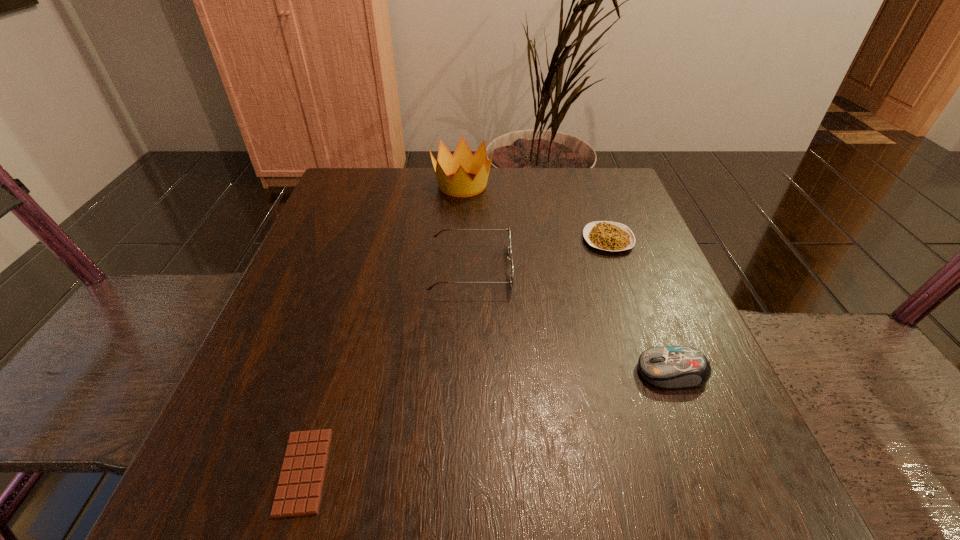
I want to click on free space in the image that satisfies the following two spatial constraints: 1. on the front side of the fourth tallest object; 2. on the front-facing side of the fourth shortest object, so click(618, 268).

Where is `vacant region that satisfies the following two spatial constraints: 1. on the front side of the legume; 2. on the right side of the tallest object`? vacant region that satisfies the following two spatial constraints: 1. on the front side of the legume; 2. on the right side of the tallest object is located at coordinates (460, 240).

You are a GUI agent. You are given a task and a screenshot of the screen. Output one action in this format:
    pyautogui.click(x=<x>, y=<y>)
    Task: Click on the free space in the image that satisfies the following two spatial constraints: 1. on the front side of the second shortest object; 2. on the front-facing side of the fourth shortest object
    
    Given the screenshot: What is the action you would take?
    pyautogui.click(x=618, y=268)